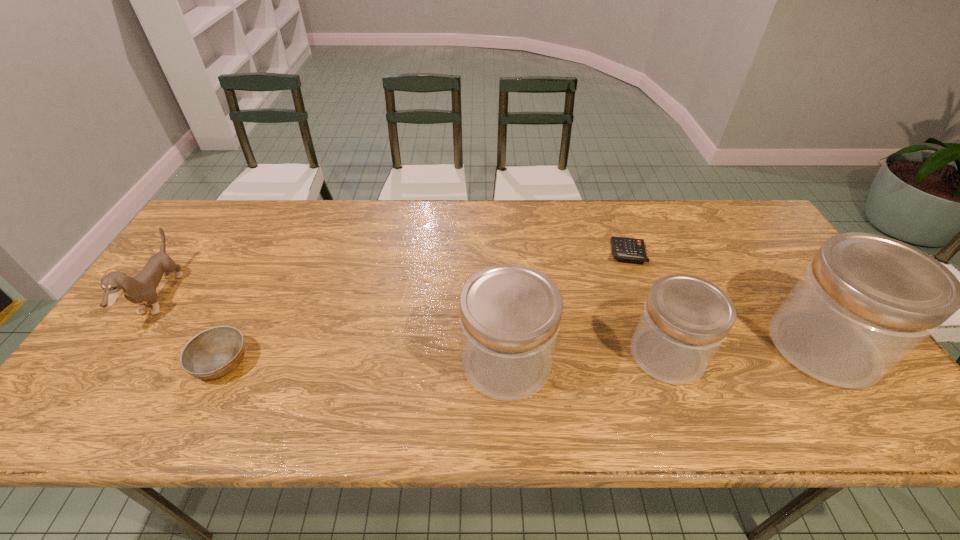
Locate an element on the screen. free space located on the back of the leftmost jar is located at coordinates (504, 307).

Find the location of a particular element. vacant region located 0.300m on the back of the second jar from left to right is located at coordinates (629, 248).

Find the location of a particular element. This screenshot has height=540, width=960. blank space located 0.330m on the back of the rightmost object is located at coordinates (745, 230).

Where is `vacant space located 0.330m on the left of the calculator`? The image size is (960, 540). vacant space located 0.330m on the left of the calculator is located at coordinates point(500,253).

This screenshot has width=960, height=540. I want to click on vacant region located 0.280m at the face of the fourth tallest object, so click(x=276, y=298).

You are a GUI agent. You are given a task and a screenshot of the screen. Output one action in this format:
    pyautogui.click(x=<x>, y=<y>)
    Task: Click on the free region located on the right of the bowl
    
    Given the screenshot: What is the action you would take?
    pyautogui.click(x=300, y=362)

The width and height of the screenshot is (960, 540). Find the location of `object positioned at the far edge`. object positioned at the far edge is located at coordinates (633, 249).

Locate an element on the screen. The image size is (960, 540). bowl that is at the near edge is located at coordinates (213, 353).

You are a GUI agent. You are given a task and a screenshot of the screen. Output one action in this format:
    pyautogui.click(x=<x>, y=<y>)
    Task: Click on the object that is at the left edge
    This screenshot has height=540, width=960.
    Given the screenshot: What is the action you would take?
    pyautogui.click(x=142, y=288)

This screenshot has height=540, width=960. Find the location of `object that is at the right edge`. object that is at the right edge is located at coordinates (865, 302).